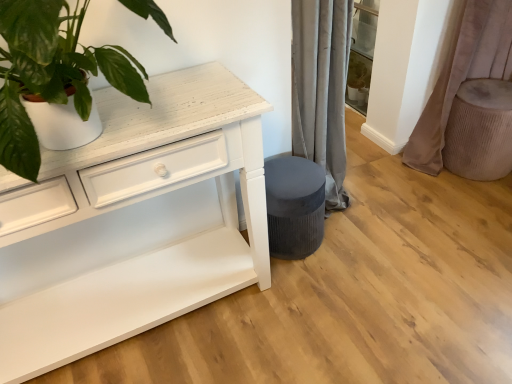
The image size is (512, 384). In order to click on free space in front of velvet dark gray stool at lower center in this screenshot , I will do `click(306, 290)`.